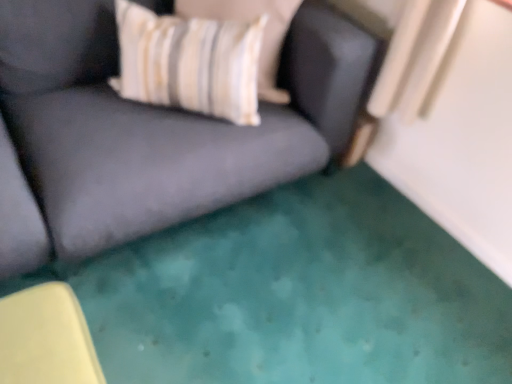
Question: Is point (269, 94) closer or farther from the camera than point (245, 48)?

Choices:
 (A) closer
 (B) farther

Answer: (B)

Question: Would you say striped fabric pillow at upper center is inside or outside white striped fabric pillow at upper left?

Choices:
 (A) outside
 (B) inside

Answer: (A)

Question: Estimate the real-world distances between objects in this image. Which object is farther from the striped fabric pillow at upper center?

Choices:
 (A) velvet dark gray couch at center
 (B) white striped fabric pillow at upper left

Answer: (A)

Question: Based on their relative distances, which object is nearer to the velvet dark gray couch at center?

Choices:
 (A) white striped fabric pillow at upper left
 (B) striped fabric pillow at upper center

Answer: (A)